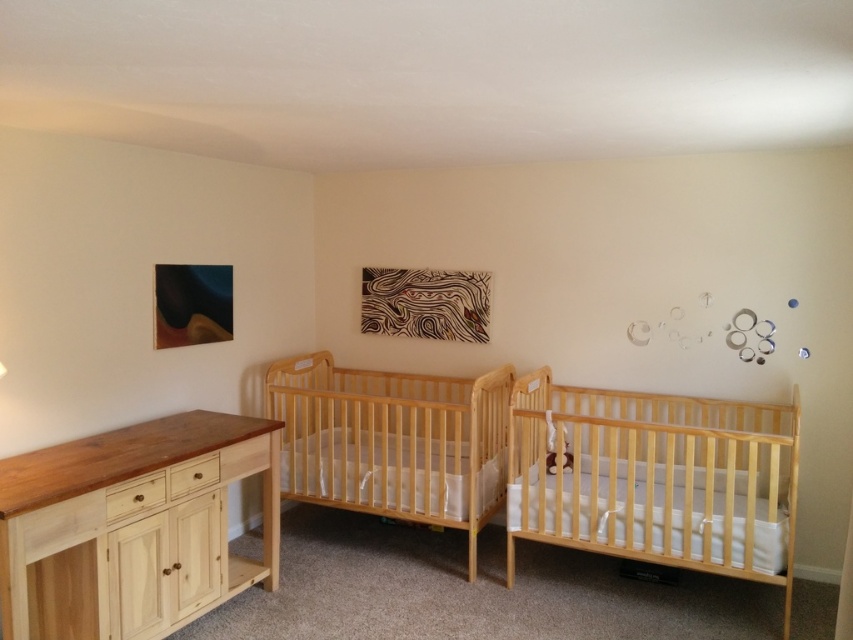
You are a parent standing in the nursery and want to place a 10 feet long toy box between the natural wood crib at center and the wooden dresser with dark brown countertop on the left. Can the toy box fit in the space between them?

The natural wood crib at center is 11.01 feet from viewer. Since the toy box is 10 feet long, it can fit in the space between the natural wood crib at center and the wooden dresser with dark brown countertop on the left as the distance is greater than the toy box length.

You are standing in the nursery room and want to place a new toy on the point that is closer to you. Which point should you choose between point (770, 557) and point (265, 451)?

Point (770, 557) is closer to the camera than point (265, 451), so you should choose point (770, 557) to place the new toy.